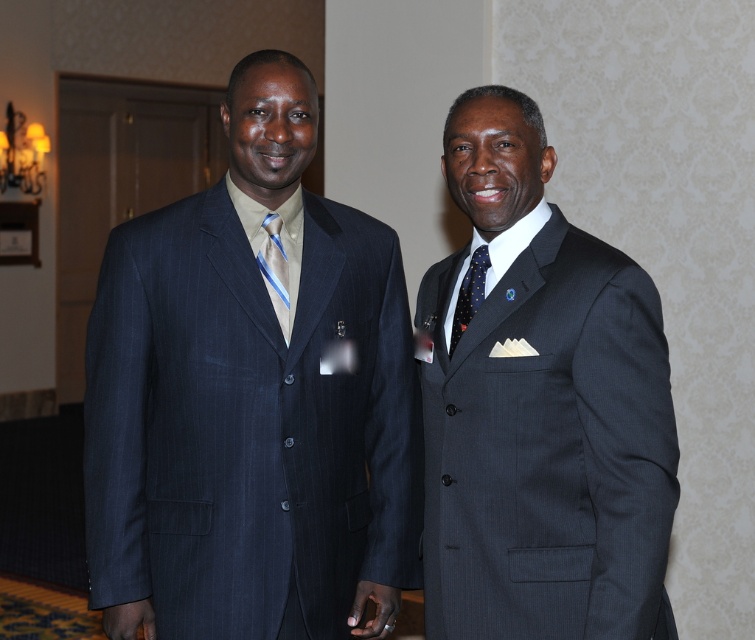
Question: Is dark gray pinstripe suit at right thinner than dark blue dotted tie at right?

Choices:
 (A) yes
 (B) no

Answer: (B)

Question: Which is farther from the matte pinstripe suit at left?

Choices:
 (A) blue striped tie at center
 (B) dark gray pinstripe suit at right

Answer: (B)

Question: Can you confirm if dark gray pinstripe suit at right is positioned above dark blue dotted tie at right?

Choices:
 (A) no
 (B) yes

Answer: (A)

Question: Which point is closer to the camera?

Choices:
 (A) (476, 257)
 (B) (285, 273)

Answer: (A)

Question: Does matte pinstripe suit at left have a lesser width compared to dark gray pinstripe suit at right?

Choices:
 (A) no
 (B) yes

Answer: (A)

Question: Which of the following is the closest to the observer?

Choices:
 (A) (472, 275)
 (B) (282, 268)
 (C) (173, 625)

Answer: (A)